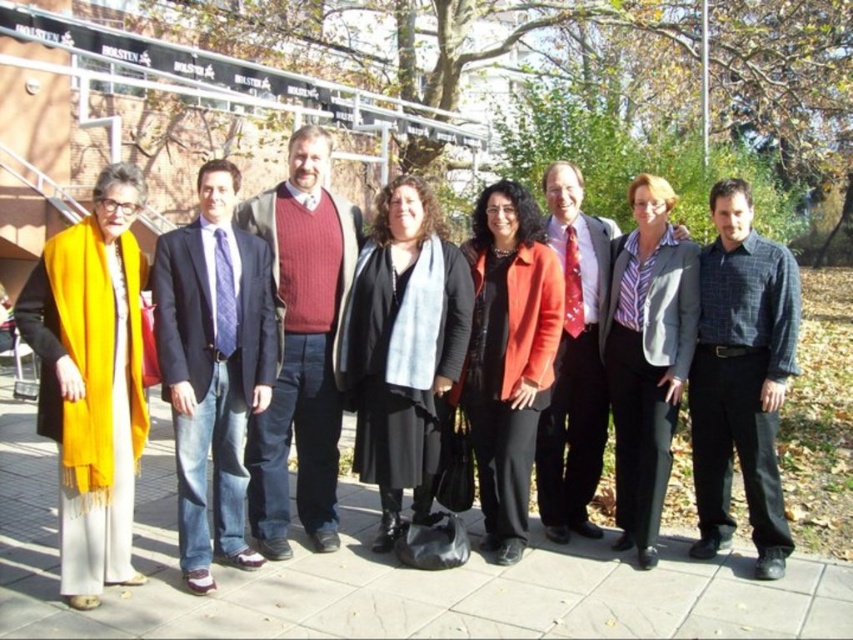
Question: Which object is the closest to the black matte coat at center?

Choices:
 (A) matte yellow scarf at left
 (B) knitted sweater at center

Answer: (B)

Question: Where is matte blue suit at center located in relation to gray blazer at center in the image?

Choices:
 (A) right
 (B) left

Answer: (B)

Question: Can you confirm if matte yellow scarf at left is positioned to the right of gray blazer at center?

Choices:
 (A) yes
 (B) no

Answer: (B)

Question: Which point appears closest to the camera in this image?

Choices:
 (A) (669, 269)
 (B) (534, 333)
 (C) (225, 186)
 (D) (112, 269)

Answer: (D)

Question: Does matte yellow scarf at left lie behind gray blazer at center?

Choices:
 (A) no
 (B) yes

Answer: (A)

Question: Which point is farther to the camera?

Choices:
 (A) (260, 531)
 (B) (219, 444)
 (C) (479, 381)

Answer: (C)